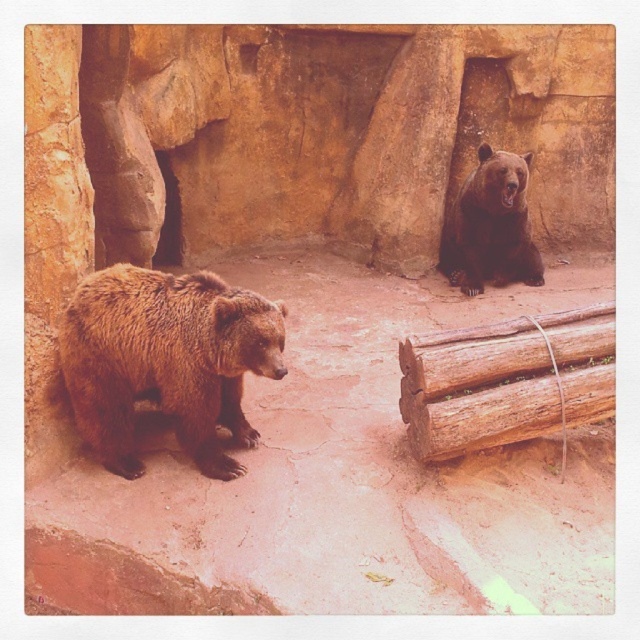
Question: Among these objects, which one is farthest from the camera?

Choices:
 (A) brown rough wood at lower right
 (B) brown furry bear at upper right
 (C) brown furry bear at left

Answer: (B)

Question: Which object is farther from the camera taking this photo?

Choices:
 (A) brown furry bear at upper right
 (B) brown rough wood at lower right
 (C) brown furry bear at left

Answer: (A)

Question: Which point is farther to the camera?

Choices:
 (A) brown rough wood at lower right
 (B) brown furry bear at upper right

Answer: (B)

Question: Does brown rough wood at lower right have a smaller size compared to brown furry bear at upper right?

Choices:
 (A) no
 (B) yes

Answer: (B)

Question: Is brown furry bear at left smaller than brown furry bear at upper right?

Choices:
 (A) no
 (B) yes

Answer: (B)

Question: Considering the relative positions of brown furry bear at left and brown rough wood at lower right in the image provided, where is brown furry bear at left located with respect to brown rough wood at lower right?

Choices:
 (A) left
 (B) right

Answer: (A)